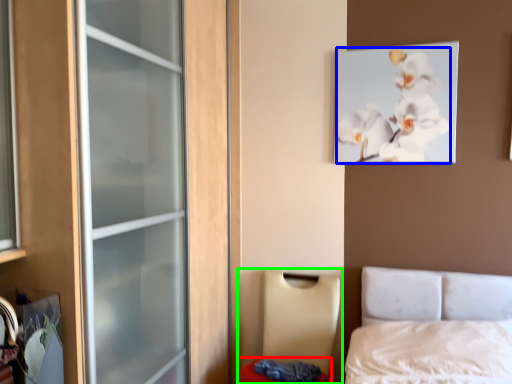
Question: Which is nearer to the mattress (highlighted by a red box)? flower (highlighted by a blue box) or furniture (highlighted by a green box).

Choices:
 (A) flower
 (B) furniture

Answer: (B)